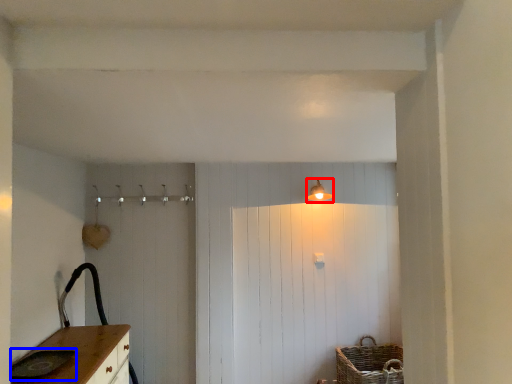
Question: Which of the following is the closest to the observer, light fixture (highlighted by a red box) or sink (highlighted by a blue box)?

Choices:
 (A) light fixture
 (B) sink

Answer: (B)